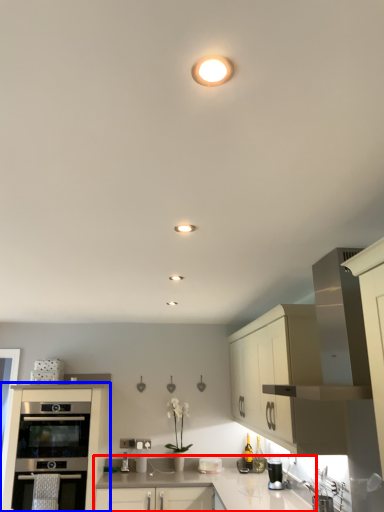
Question: Which of the following is the farthest to the observer, countertop (highlighted by a red box) or cabinetry (highlighted by a blue box)?

Choices:
 (A) countertop
 (B) cabinetry

Answer: (A)